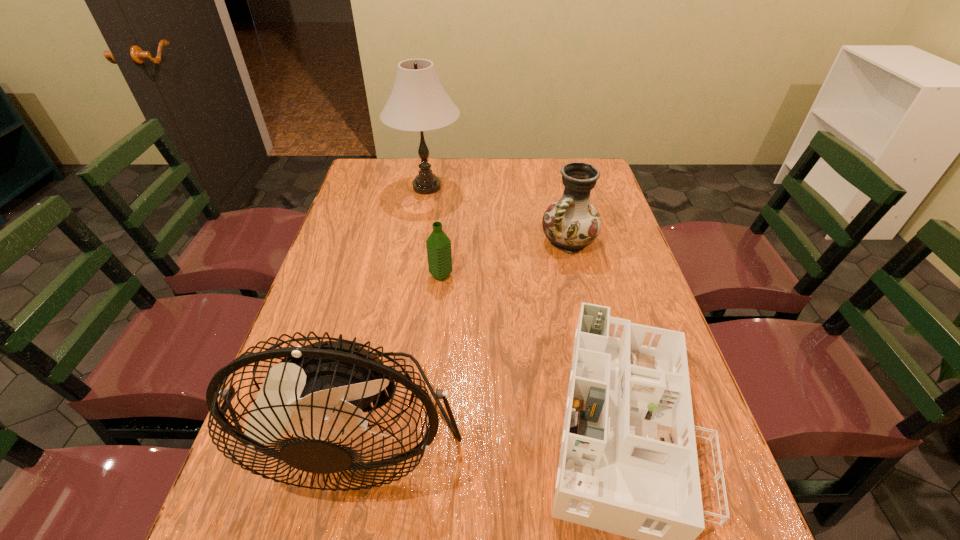
Image resolution: width=960 pixels, height=540 pixels. I want to click on the farthest object, so [x=418, y=102].

You are a GUI agent. You are given a task and a screenshot of the screen. Output one action in this format:
    pyautogui.click(x=<x>, y=<y>)
    Task: Click on the fan
    This screenshot has width=960, height=540.
    Given the screenshot: What is the action you would take?
    pyautogui.click(x=322, y=390)

Where is `the fourth nearest object`? This screenshot has width=960, height=540. the fourth nearest object is located at coordinates (572, 223).

Locate an element on the screen. This screenshot has width=960, height=540. the third tallest object is located at coordinates (572, 223).

Locate an element on the screen. the third nearest object is located at coordinates (438, 244).

This screenshot has width=960, height=540. Identify the location of the fourth tallest object. (438, 244).

Locate an element on the screen. free region located on the right of the farthest object is located at coordinates (571, 187).

At what (x,y) coordinates should I click in order to perform the action: click on blank space located on the left of the fourth nearest object. Please return your answer as a coordinate pair (x, y). The image size is (960, 540). Looking at the image, I should click on (459, 241).

At what (x,y) coordinates should I click in order to perform the action: click on vacant region located on the right of the fourth tallest object. Please return your answer as a coordinate pair (x, y). This screenshot has height=540, width=960. Looking at the image, I should click on (492, 275).

The width and height of the screenshot is (960, 540). I want to click on object that is at the far edge, so click(418, 102).